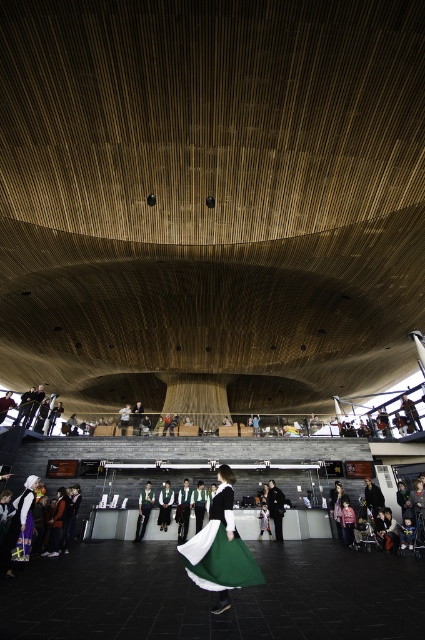
Question: Is green satin dress at center smaller than matte black dress at center?

Choices:
 (A) no
 (B) yes

Answer: (B)

Question: Which object appears farthest from the camera in this image?

Choices:
 (A) green satin dress at center
 (B) matte black dress at center

Answer: (B)

Question: Is green satin dress at center positioned at the back of matte black dress at center?

Choices:
 (A) yes
 (B) no

Answer: (B)

Question: Is green satin dress at center above matte black dress at center?

Choices:
 (A) no
 (B) yes

Answer: (B)

Question: Which point is closer to the camera taking this photo?

Choices:
 (A) (229, 484)
 (B) (337, 488)

Answer: (A)